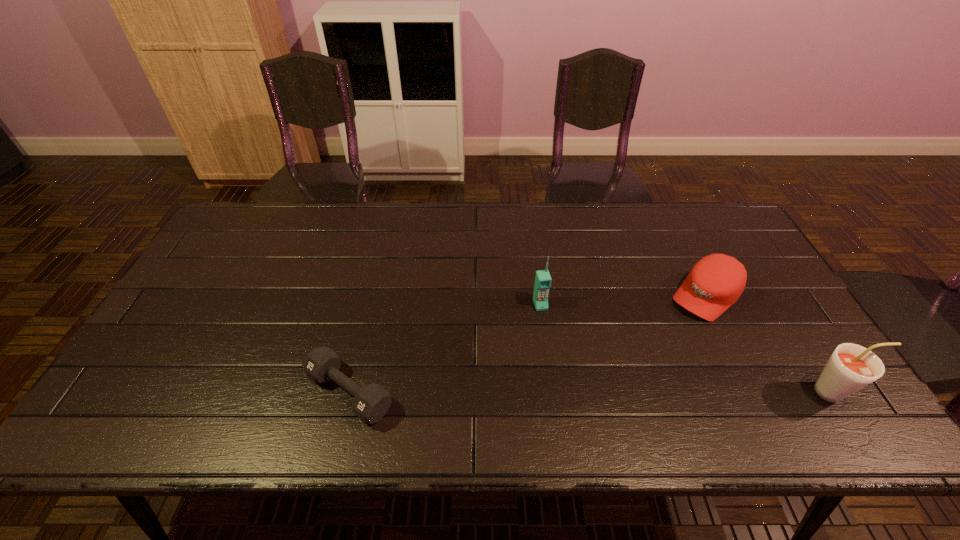
In the image, there is a desktop. Identify the location of vacant space at the left edge. This screenshot has width=960, height=540. (202, 268).

At what (x,y) coordinates should I click in order to perform the action: click on free space at the right edge. Please return your answer as a coordinate pair (x, y). The height and width of the screenshot is (540, 960). Looking at the image, I should click on (779, 321).

What are the coordinates of `vacant position at the near right corner of the desktop` in the screenshot? It's located at (783, 378).

Image resolution: width=960 pixels, height=540 pixels. In order to click on free space between the cap and the root beer in this screenshot , I will do pyautogui.click(x=770, y=344).

Where is `unoccupied position between the second object from left to right and the cap`? The width and height of the screenshot is (960, 540). unoccupied position between the second object from left to right and the cap is located at coordinates (623, 300).

Locate an element on the screen. free space between the dumbbell and the third tallest object is located at coordinates (528, 344).

The image size is (960, 540). Identify the location of free spot between the rightmost object and the shortest object. (591, 392).

Image resolution: width=960 pixels, height=540 pixels. I want to click on unoccupied position between the root beer and the second object from left to right, so click(x=687, y=348).

Identify the location of free space between the root beer and the cap. Image resolution: width=960 pixels, height=540 pixels. (770, 344).

This screenshot has height=540, width=960. I want to click on vacant area that lies between the second object from right to left and the cellular telephone, so click(x=623, y=300).